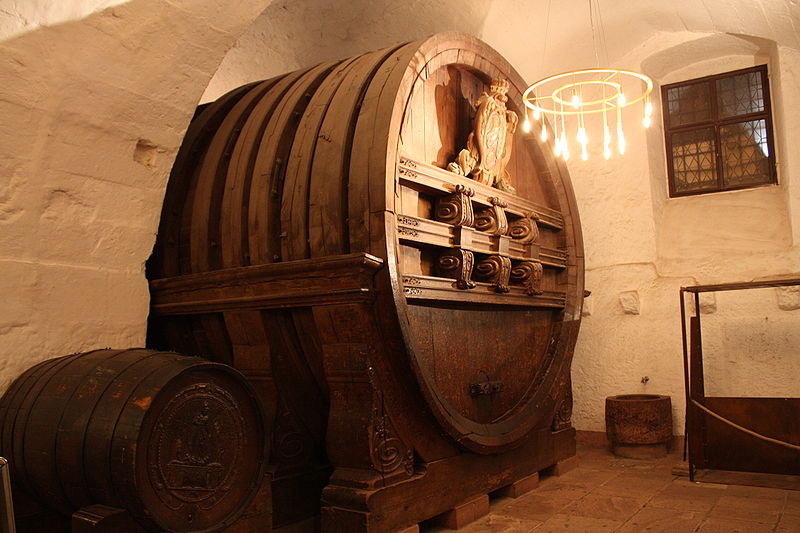
You are a GUI agent. You are given a task and a screenshot of the screen. Output one action in this format:
    pyautogui.click(x=<x>, y=<y>)
    Task: Click on the white right wall
    The height and width of the screenshot is (533, 800).
    Given the screenshot: What is the action you would take?
    (613, 207)